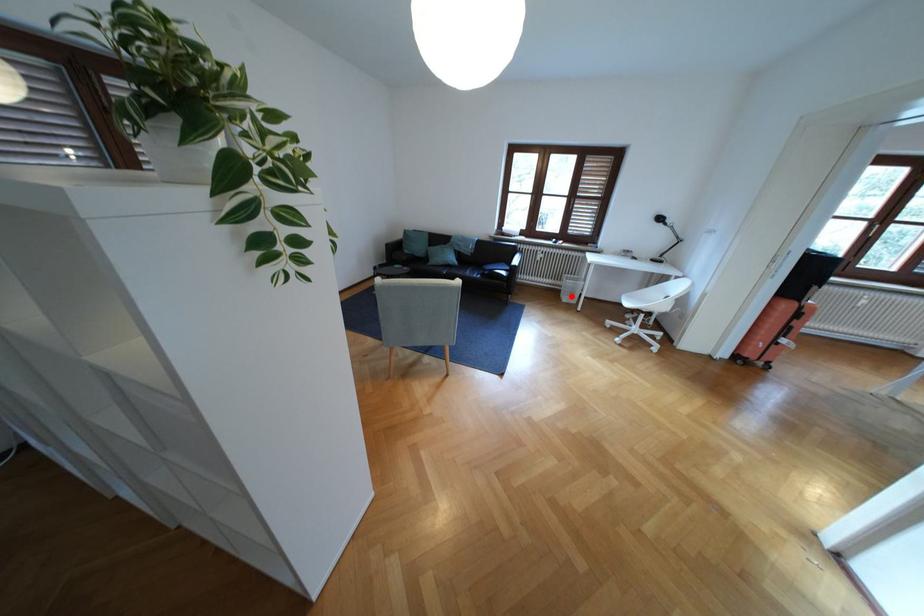
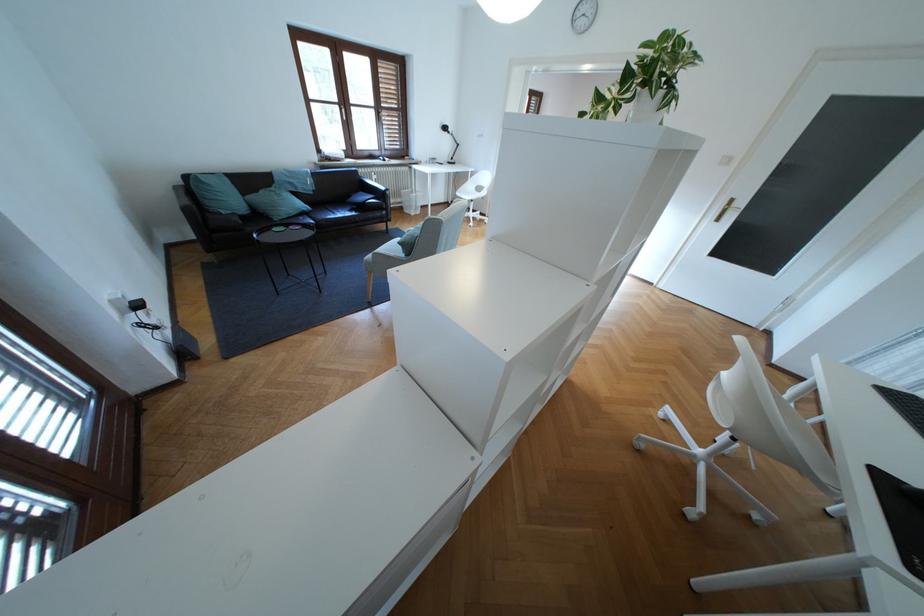
Locate, in the second image, the point that corresponds to the highlighted location in the first image.

(417, 211)